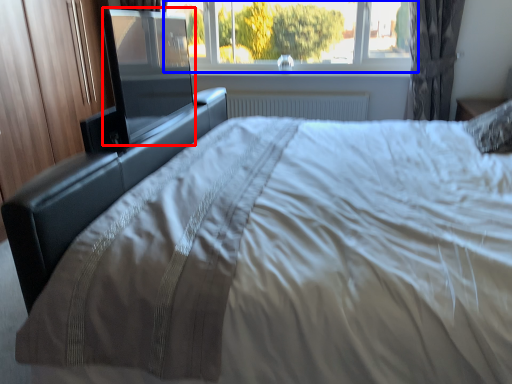
Question: Which object is closer to the camera taking this photo, screen door (highlighted by a red box) or window (highlighted by a blue box)?

Choices:
 (A) screen door
 (B) window

Answer: (A)